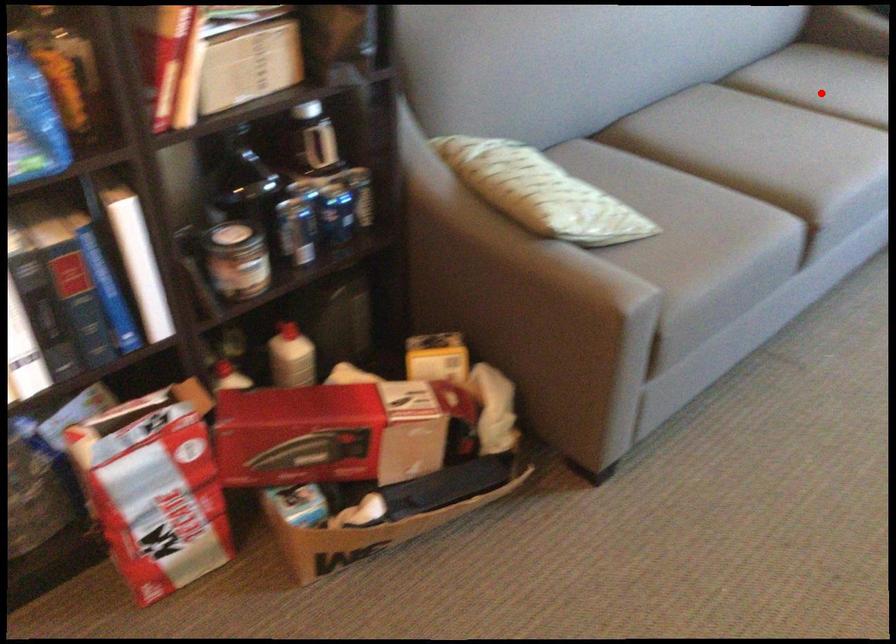
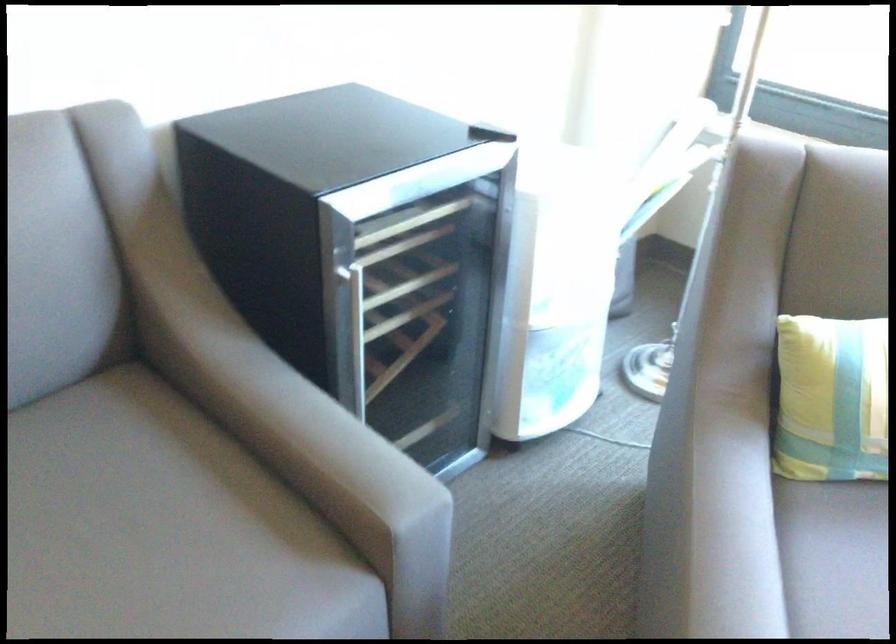
Question: I am providing you with two images of the same scene from different viewpoints. A red point is shown in image1. For the corresponding object point in image2, is it positioned nearer or farther from the camera?

Choices:
 (A) Nearer
 (B) Farther

Answer: (A)